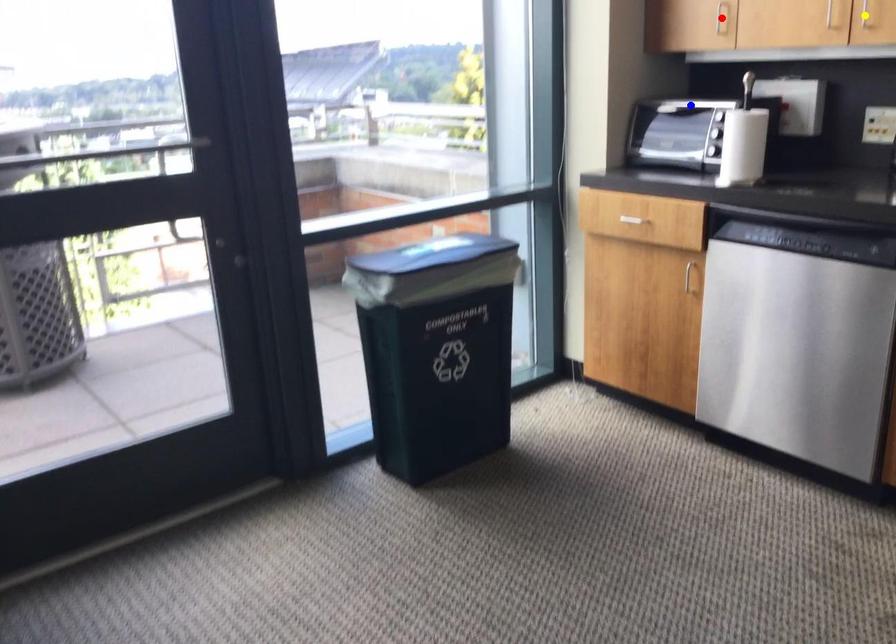
Order these from nearest to farthest:
- blue point
- red point
- yellow point

yellow point, red point, blue point